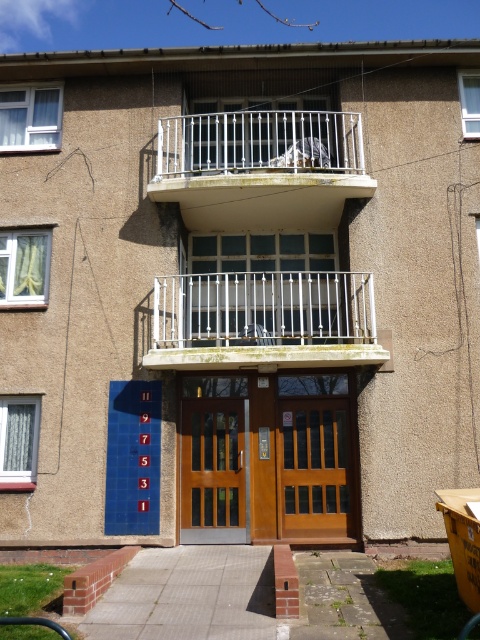
I want to click on brown wooden door at center, so click(214, 472).

Between brown wooden door at center and wooden door at center, which one has less height?

wooden door at center

Is point (220, 536) positioned after point (320, 500)?

No, it is not.

I want to click on brown wooden door at center, so click(x=214, y=472).

Does silver metallic balcony at center lie behind silver metallic railing at upper center?

No, silver metallic balcony at center is closer to the viewer.

Can you confirm if silver metallic balcony at center is thinner than silver metallic railing at upper center?

Indeed, silver metallic balcony at center has a lesser width compared to silver metallic railing at upper center.

What do you see at coordinates (264, 321) in the screenshot?
I see `silver metallic balcony at center` at bounding box center [264, 321].

Identify the location of silver metallic balcony at center. The height and width of the screenshot is (640, 480). (264, 321).

Looking at this image, can you confirm if silver metallic railing at upper center is wider than wooden door at center?

Yes.

Does silver metallic railing at upper center appear over wooden door at center?

Correct, silver metallic railing at upper center is located above wooden door at center.

Describe the element at coordinates (257, 152) in the screenshot. This screenshot has width=480, height=640. I see `silver metallic railing at upper center` at that location.

Image resolution: width=480 pixels, height=640 pixels. I want to click on silver metallic railing at upper center, so click(257, 152).